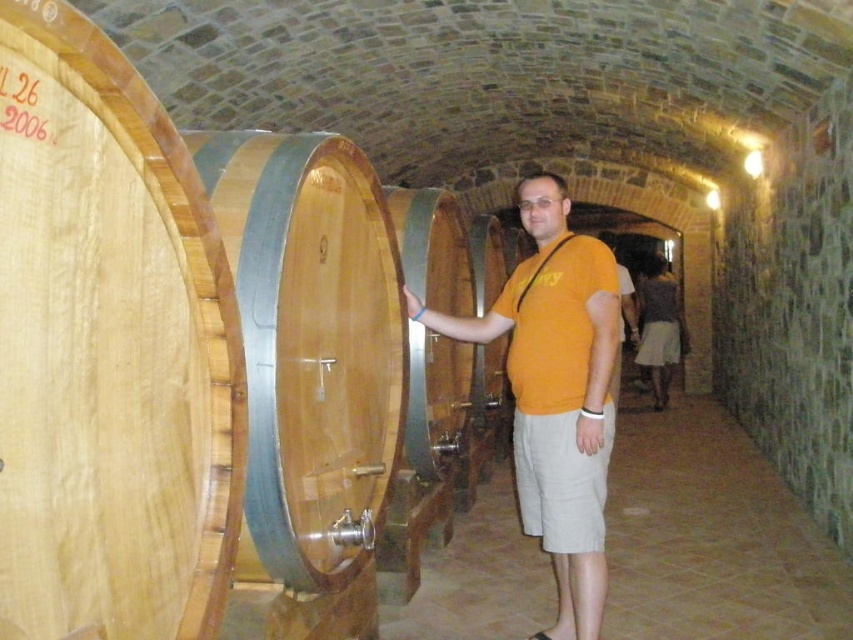
You are a worker in the wine cellar and need to lift both the natural wood barrel at center and the orange cotton shirt at center. Which object is easier to lift based on their sizes?

The natural wood barrel at center is thinner than the orange cotton shirt at center, so it might be easier to lift the natural wood barrel at center since it has a smaller size.

You are standing in the wine cellar and see two points marked in the image. Which point is closer to you, point (x=361, y=221) or point (x=408, y=298)?

Point (x=361, y=221) is closer to the viewer than point (x=408, y=298).